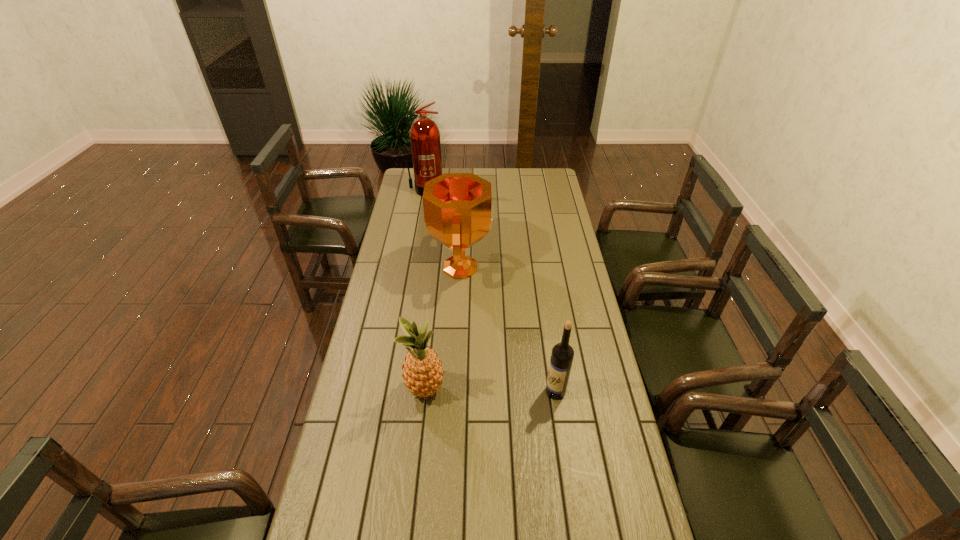
Identify the location of vacant space that is in between the farthest object and the wine bottle. (490, 291).

This screenshot has width=960, height=540. I want to click on vacant region between the pineapple and the rightmost object, so click(x=491, y=391).

Select which object appears as the third closest to the award. Please provide its 2D coordinates. Your answer should be formatted as a tuple, i.e. [(x, y)], where the tuple contains the x and y coordinates of a point satisfying the conditions above.

[(562, 355)]

The height and width of the screenshot is (540, 960). Find the location of `object that is the second closest one to the pineapple`. object that is the second closest one to the pineapple is located at coordinates (458, 213).

Image resolution: width=960 pixels, height=540 pixels. I want to click on free point that satisfies the following two spatial constraints: 1. on the front-facing side of the pineapple; 2. on the left side of the farthest object, so (x=388, y=390).